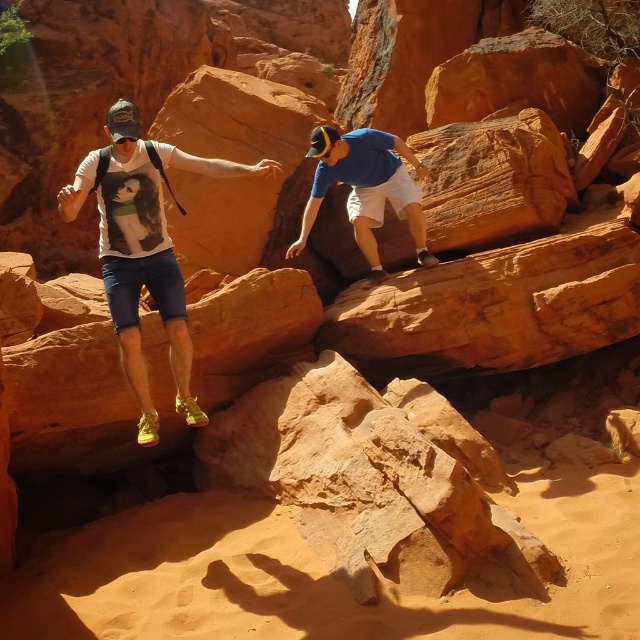
Question: Does matte white t-shirt at left have a larger size compared to blue cotton shirt at center?

Choices:
 (A) yes
 (B) no

Answer: (A)

Question: Which object appears farthest from the camera in this image?

Choices:
 (A) blue cotton shirt at center
 (B) matte white t-shirt at left

Answer: (A)

Question: Can you confirm if matte white t-shirt at left is positioned below blue cotton shirt at center?

Choices:
 (A) yes
 (B) no

Answer: (A)

Question: Which point appears farthest from the camera in this image?

Choices:
 (A) (355, 166)
 (B) (124, 147)

Answer: (A)

Question: Where is matte white t-shirt at left located in relation to blue cotton shirt at center in the image?

Choices:
 (A) right
 (B) left

Answer: (B)